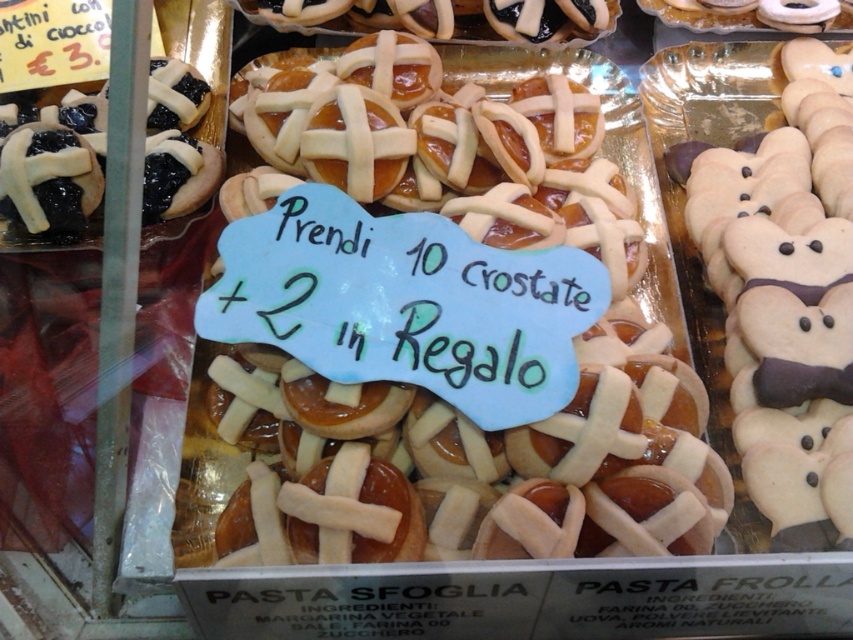
You are a customer looking at the display of pastries. You notice the white fondant bear at right and the matte black pastry at upper left. Which pastry is located to the right of the other?

The white fondant bear at right is positioned on the right side of matte black pastry at upper left.

Consider the image. You are a customer looking at the display of pastries. There is a point marked at coordinates (177, 141). What is the color and type of pastry located at that point?

The point at coordinates (177, 141) marks a matte black pastry at upper left.